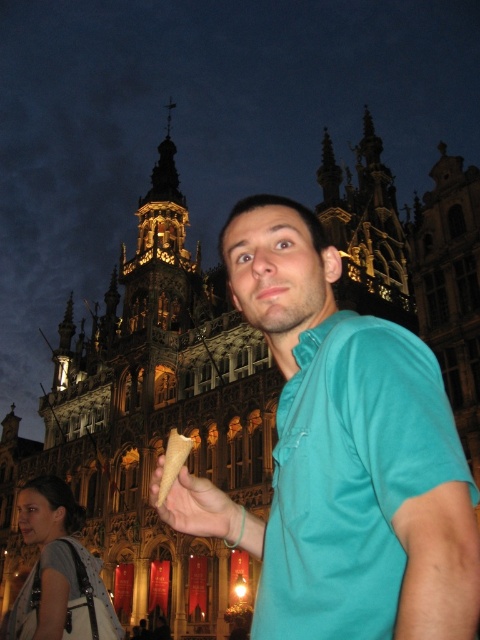
You are a photographer trying to capture the ice cream cone in the image. You need to ensure that both the smooth beige cone at center and the golden waffle cone at center are clearly visible in your shot. Given their size difference, which cone should you focus on to ensure both are in frame without cropping?

The smooth beige cone at center is larger than the golden waffle cone at center, so focusing on the larger smooth beige cone at center will ensure both are visible without cropping.